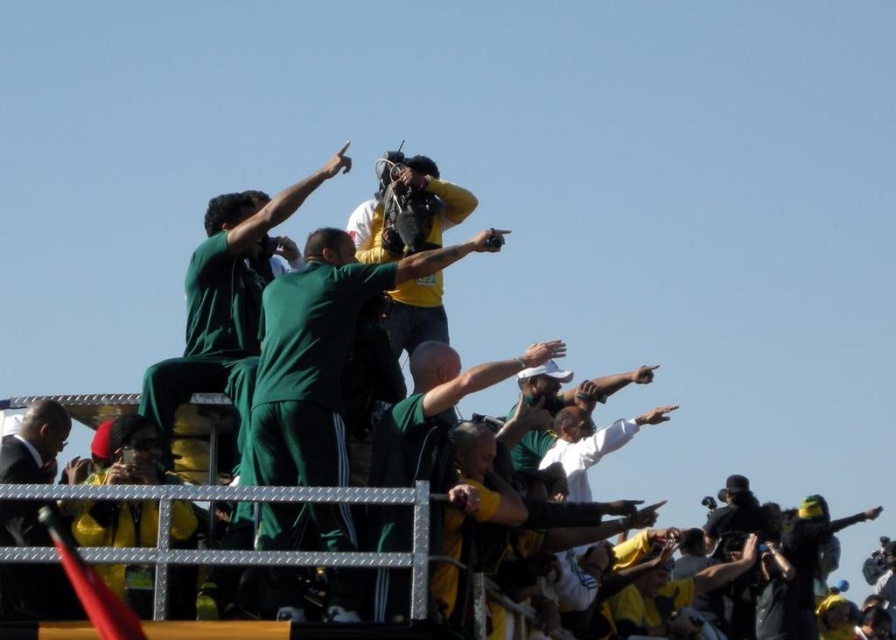
In the scene shown: You are standing at the center of the scene and want to move towards the point closer to the camera between point (254,464) and point (461,372). Which point should you move towards?

You should move towards point (254,464) because it is closer to the camera than point (461,372).

You are standing at the camera position and want to hand a trophy to the person in the green jersey at center. Considering the distance, can you reach them without moving from your current position?

The distance between you and the green jersey at center is 350.57 feet, which is too far to reach without moving closer. You would need to approach them to deliver the trophy.

You are standing at the origin point of the image. Which direction should you move to locate the green jersey at center?

The green jersey at center is located at coordinate point 0.655 on the x axis and 0.489 on the y axis. Since the origin is at the bottom left corner of the image, you should move to the right and slightly upward to reach the green jersey at center.